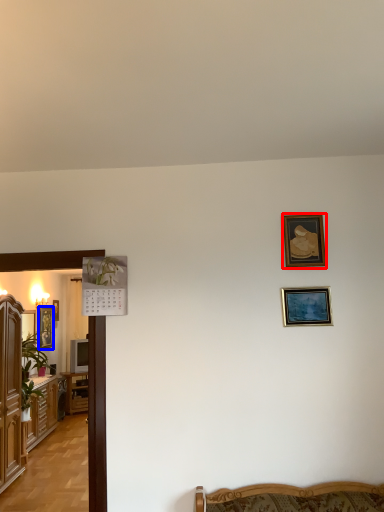
Question: Among these objects, which one is farthest to the camera, picture frame (highlighted by a red box) or picture frame (highlighted by a blue box)?

Choices:
 (A) picture frame
 (B) picture frame

Answer: (B)